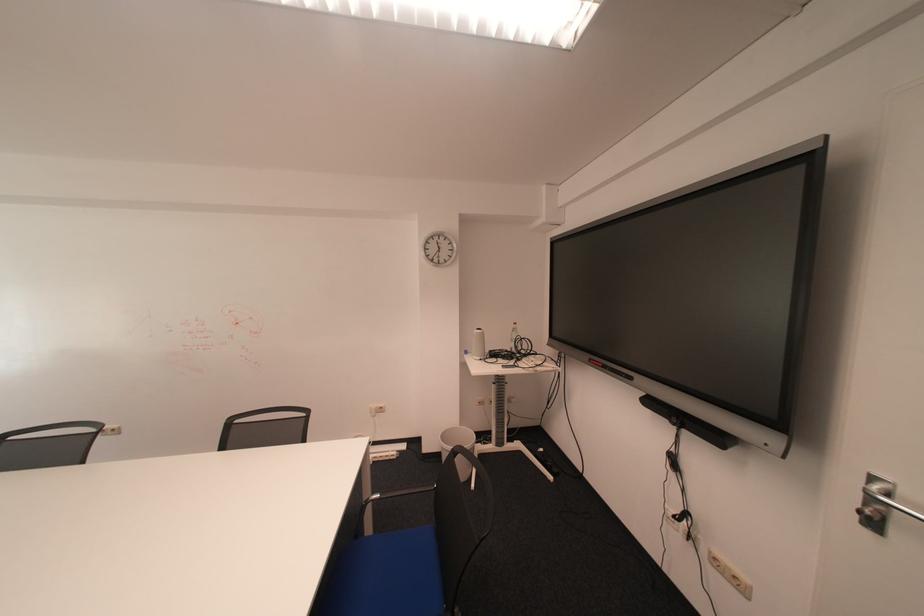
Locate an element on the screen. This screenshot has width=924, height=616. blue chair armrest is located at coordinates (397, 493).